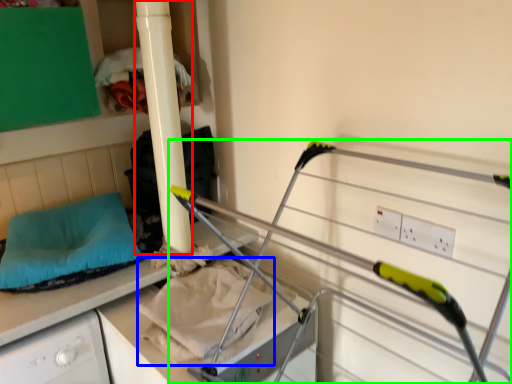
Question: Considering the real-world distances, which object is closest to pillar (highlighted by a red box)? sheet (highlighted by a blue box) or bunk bed (highlighted by a green box).

Choices:
 (A) sheet
 (B) bunk bed

Answer: (A)